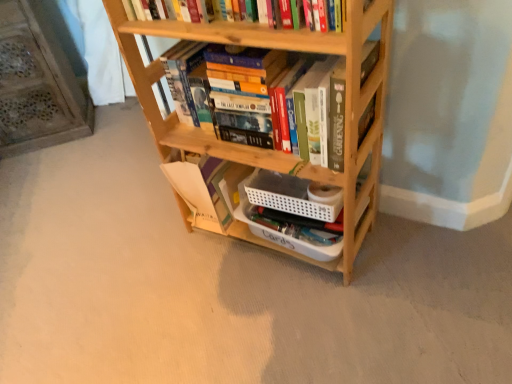
Where is `vacant region in front of natural wood bookcase at center`? vacant region in front of natural wood bookcase at center is located at coordinates (307, 320).